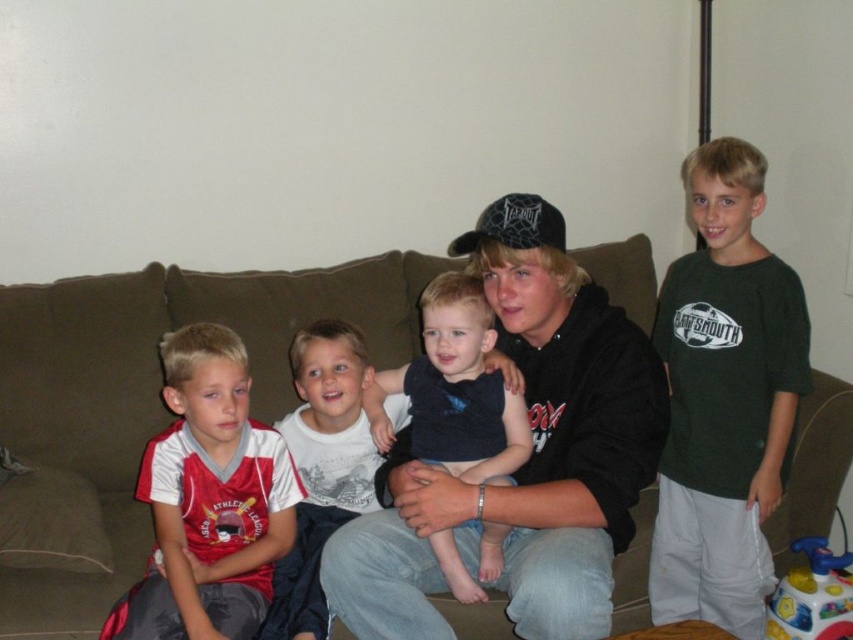
You are planning to place a decorative pillow on the brown fabric couch at center. Considering the size of the white cotton shirt at center, will the pillow fit comfortably on the couch without overcrowding it?

The brown fabric couch at center might be wider than white cotton shirt at center, so there should be enough space for the pillow to fit comfortably without overcrowding.

Based on the scene description, which object is taller between the black matte hoodie at center and the white cotton shirt at center?

The black matte hoodie at center is much taller than the white cotton shirt at center.

You are a photographer setting up a shoot in this living room. You want to ensure that both the black matte hoodie at center and the white cotton shirt at center are clearly visible in the photo. Given their current positions, which item is closer to the camera, and why?

The black matte hoodie at center is closer to the camera because it is in front of the white cotton shirt at center, making it appear nearer in the photo.